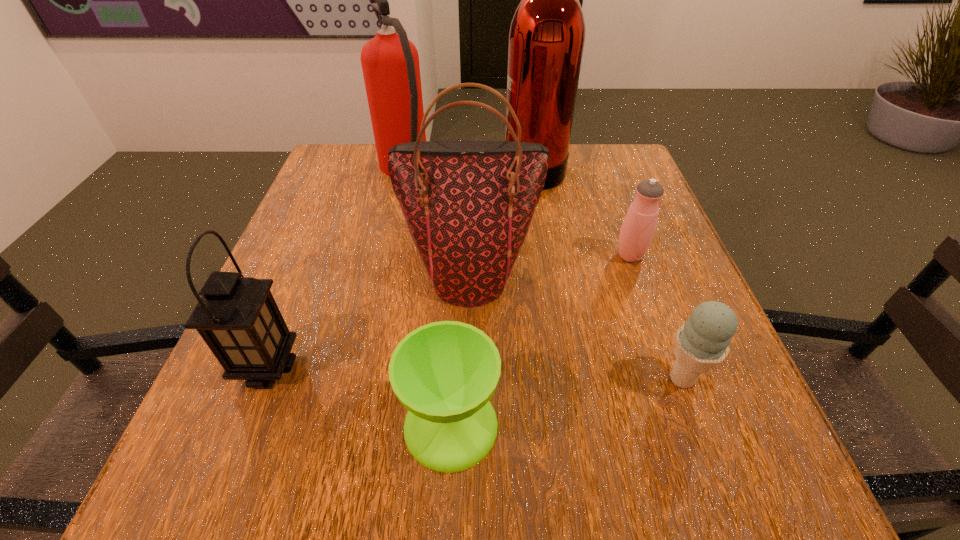
Where is `vacant region between the handbag and the fourth tallest object`? vacant region between the handbag and the fourth tallest object is located at coordinates (370, 321).

I want to click on blank region between the handbag and the fourth shortest object, so click(370, 321).

I want to click on vacant area that lies between the taller fire extinguisher and the ice cream, so click(608, 272).

Select which object appears as the fifth closest to the ice cream. Please provide its 2D coordinates. Your answer should be formatted as a tuple, i.e. [(x, y)], where the tuple contains the x and y coordinates of a point satisfying the conditions above.

[(237, 317)]

Locate an element on the screen. object that can be found as the third closest to the handbag is located at coordinates (237, 317).

Where is `vacant space that satisfies the following two spatial constraints: 1. on the front-facing side of the tallest object; 2. on the back side of the thermos bottle`? This screenshot has width=960, height=540. vacant space that satisfies the following two spatial constraints: 1. on the front-facing side of the tallest object; 2. on the back side of the thermos bottle is located at coordinates (547, 255).

At what (x,y) coordinates should I click in order to perform the action: click on free space that satisfies the following two spatial constraints: 1. on the back side of the thermos bottle; 2. on the left side of the handbag. Please return your answer as a coordinate pair (x, y). This screenshot has width=960, height=540. Looking at the image, I should click on point(471,255).

Where is `free spot that satisfies the following two spatial constraints: 1. on the front side of the handbag; 2. on the left side of the ice cream`? The height and width of the screenshot is (540, 960). free spot that satisfies the following two spatial constraints: 1. on the front side of the handbag; 2. on the left side of the ice cream is located at coordinates (468, 378).

Locate an element on the screen. The height and width of the screenshot is (540, 960). vacant area that satisfies the following two spatial constraints: 1. on the front-facing side of the tallest object; 2. on the left side of the ice cream is located at coordinates (566, 378).

Where is `vacant space that satisfies the following two spatial constraints: 1. on the front-facing side of the right fire extinguisher; 2. on the front side of the lantern`? vacant space that satisfies the following two spatial constraints: 1. on the front-facing side of the right fire extinguisher; 2. on the front side of the lantern is located at coordinates (564, 367).